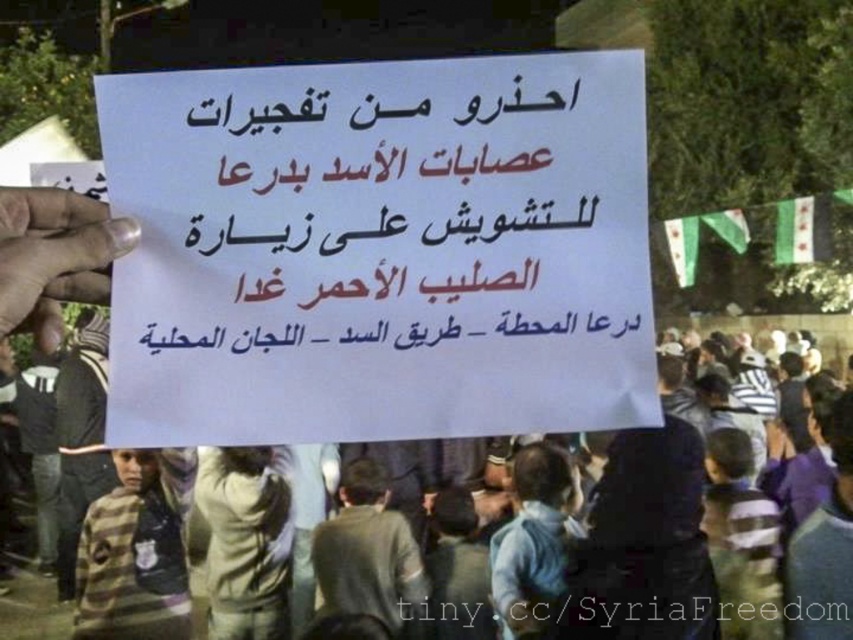
Consider the image. Is white paper sign at center to the right of gray woolen sweater at center from the viewer's perspective?

Yes, white paper sign at center is to the right of gray woolen sweater at center.

Identify the location of white paper sign at center. (380, 250).

Is point (318, 609) behind point (93, 456)?

No.

Is point (424, 614) positioned before point (77, 470)?

Yes.

Does point (358, 476) come farther from viewer compared to point (73, 570)?

That is False.

Where is `gray woolen sweater at center`? The width and height of the screenshot is (853, 640). gray woolen sweater at center is located at coordinates (369, 556).

Does white paper sign at center come in front of dark gray jacket at left?

Yes, it is in front of dark gray jacket at left.

Looking at this image, which is below, white paper sign at center or dark gray jacket at left?

dark gray jacket at left is lower down.

The width and height of the screenshot is (853, 640). In order to click on white paper sign at center in this screenshot , I will do `click(380, 250)`.